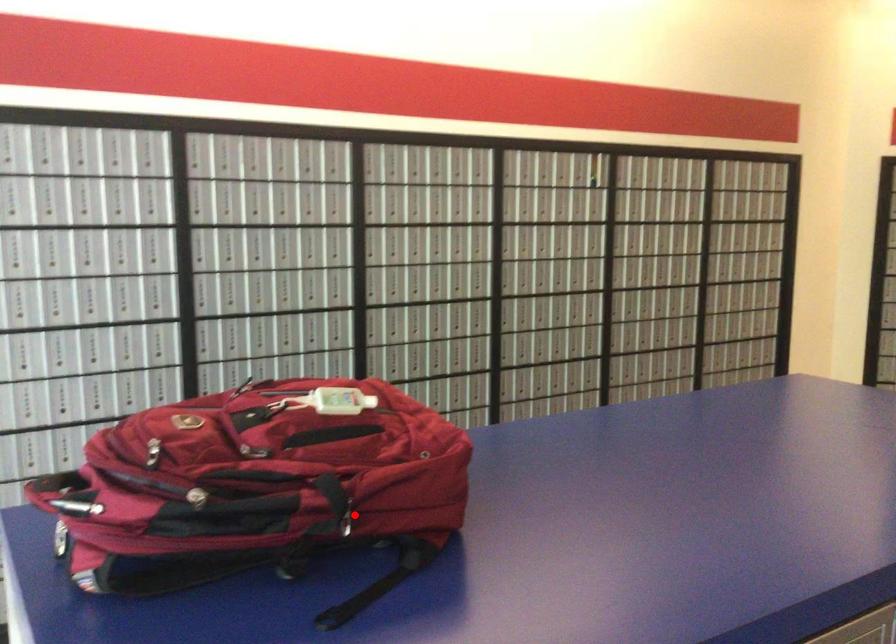
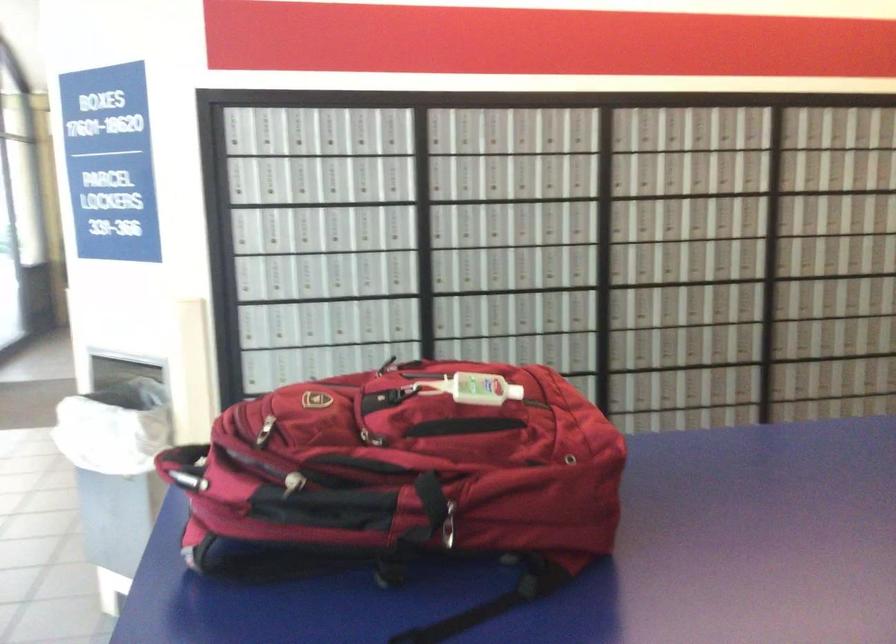
In the second image, find the point that corresponds to the highlighted location in the first image.

(446, 524)